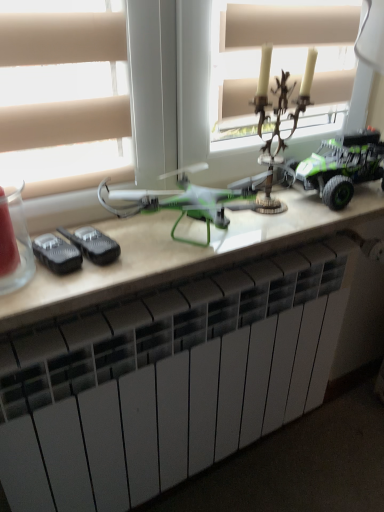
Identify the location of empty space that is ontop of white matte radiator at lower center (from a real-world perspective). Image resolution: width=384 pixels, height=512 pixels. (184, 287).